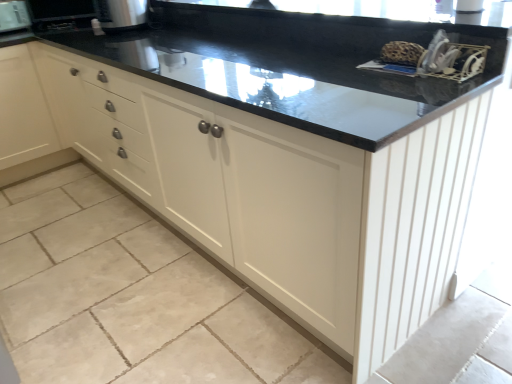
Question: Relative to satin silver toaster at upper left, which is the 2th appliance from left to right, is brushed metal toaster at upper left, the 1th appliance positioned from the back, in front or behind?

Choices:
 (A) behind
 (B) front

Answer: (A)

Question: In terms of width, does brushed metal toaster at upper left, the 1th appliance positioned from the back, look wider or thinner when compared to satin silver toaster at upper left, arranged as the 1th appliance when viewed from the right?

Choices:
 (A) wide
 (B) thin

Answer: (B)

Question: Is brushed metal toaster at upper left, the 2th appliance when ordered from right to left, bigger or smaller than satin silver toaster at upper left, arranged as the 1th appliance when viewed from the right?

Choices:
 (A) big
 (B) small

Answer: (B)

Question: In terms of size, does satin silver toaster at upper left, arranged as the 1th appliance when viewed from the right, appear bigger or smaller than brushed metal toaster at upper left, the 1th appliance positioned from the back?

Choices:
 (A) small
 (B) big

Answer: (B)

Question: Considering the positions of satin silver toaster at upper left, which is the 2th appliance from left to right, and brushed metal toaster at upper left, which appears as the second appliance when viewed from the front, in the image, is satin silver toaster at upper left, which is the 2th appliance from left to right, taller or shorter than brushed metal toaster at upper left, which appears as the second appliance when viewed from the front,?

Choices:
 (A) short
 (B) tall

Answer: (A)

Question: Is point (113, 8) positioned closer to the camera than point (19, 3)?

Choices:
 (A) closer
 (B) farther

Answer: (A)

Question: In terms of width, does satin silver toaster at upper left, which is the 2th appliance from left to right, look wider or thinner when compared to brushed metal toaster at upper left, which appears as the second appliance when viewed from the front?

Choices:
 (A) thin
 (B) wide

Answer: (B)